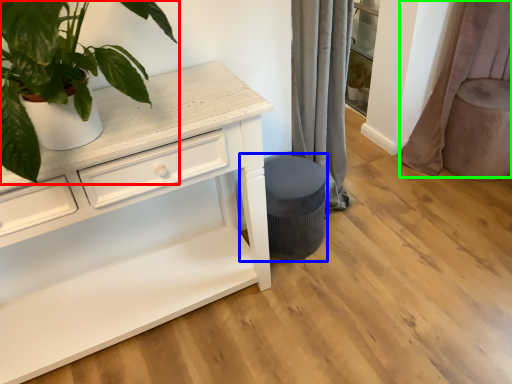
Question: Which object is positioned farthest from houseplant (highlighted by a red box)? Select from music stool (highlighted by a blue box) and curtain (highlighted by a green box).

Choices:
 (A) music stool
 (B) curtain

Answer: (B)